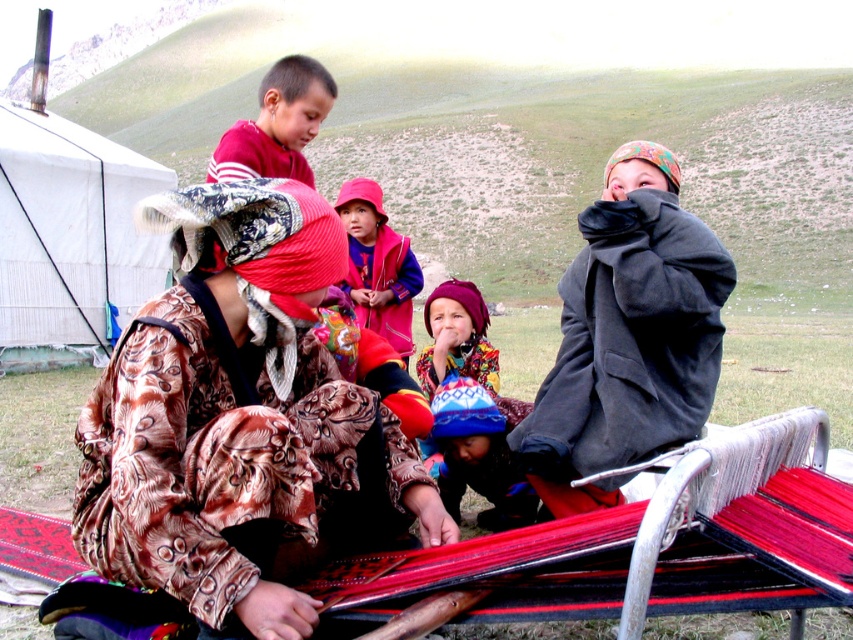
You are a photographer trying to capture both the red fleece vest at center and the multicolored knitted hat at center in a single frame. Based on their positions, which object should you adjust your camera angle to focus on first to ensure both are in the shot?

The red fleece vest at center is to the left of the multicolored knitted hat at center. To capture both in a single frame, adjust your camera angle to focus on the red fleece vest at center first, then ensure the multicolored knitted hat at center is positioned to its right in the frame.

You are standing in the rural outdoor setting shown in the image. There is a point marked at coordinates (234,467). What object is located at this point?

The brown velvety robe at center is located at point (234,467).